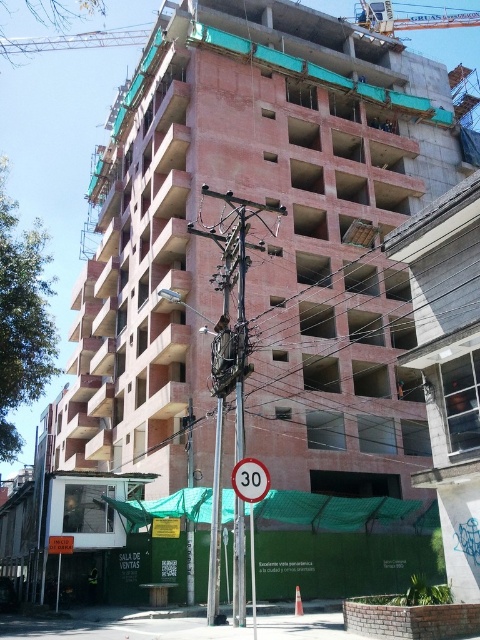
Does metallic pole at center appear under orange reflective traffic sign at center?

Incorrect, metallic pole at center is not positioned below orange reflective traffic sign at center.

What do you see at coordinates (240, 339) in the screenshot? I see `metallic pole at center` at bounding box center [240, 339].

Where is `metallic pole at center`? The height and width of the screenshot is (640, 480). metallic pole at center is located at coordinates (240, 339).

Find the location of `metallic gray crane at upper left`. metallic gray crane at upper left is located at coordinates (73, 40).

Is metallic pole at center behind brushed metal crane at upper center?

No, metallic pole at center is in front of brushed metal crane at upper center.

The image size is (480, 640). Describe the element at coordinates (240, 339) in the screenshot. I see `metallic pole at center` at that location.

Is point (235, 429) farther from viewer compared to point (382, 24)?

No, it is not.

Where is `metallic pole at center`? This screenshot has width=480, height=640. metallic pole at center is located at coordinates (240, 339).